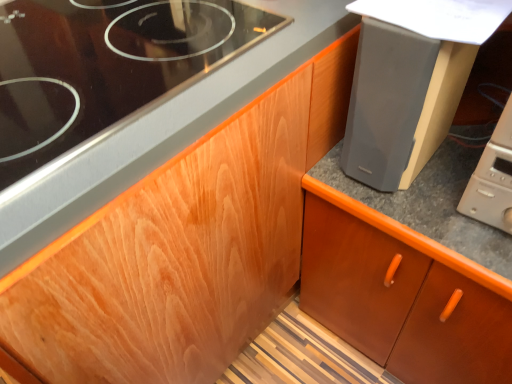
Question: Does point (181, 79) appear closer or farther from the camera than point (441, 379)?

Choices:
 (A) farther
 (B) closer

Answer: (B)

Question: Considering the relative positions of black glass gas stove at upper left and brown wood cabinet at center in the image provided, is black glass gas stove at upper left to the left or to the right of brown wood cabinet at center?

Choices:
 (A) left
 (B) right

Answer: (A)

Question: Considering the real-world distances, which object is closest to the brown wood cabinet at center?

Choices:
 (A) beige plastic microwave at lower right
 (B) matte gray speaker at upper right
 (C) black glass gas stove at upper left

Answer: (B)

Question: Estimate the real-world distances between objects in this image. Which object is closer to the black glass gas stove at upper left?

Choices:
 (A) beige plastic microwave at lower right
 (B) brown wood cabinet at center
 (C) matte gray speaker at upper right

Answer: (C)